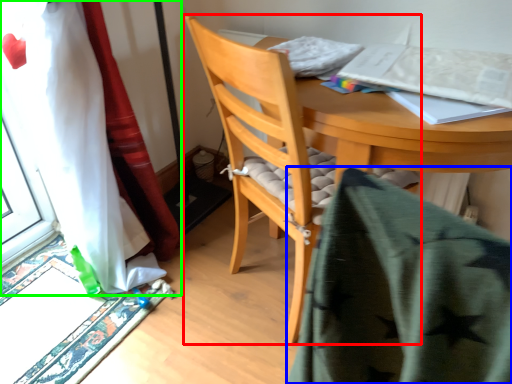
Question: Considering the real-world distances, which object is farthest from chair (highlighted by a red box)? blanket (highlighted by a blue box) or curtain (highlighted by a green box)?

Choices:
 (A) blanket
 (B) curtain

Answer: (A)